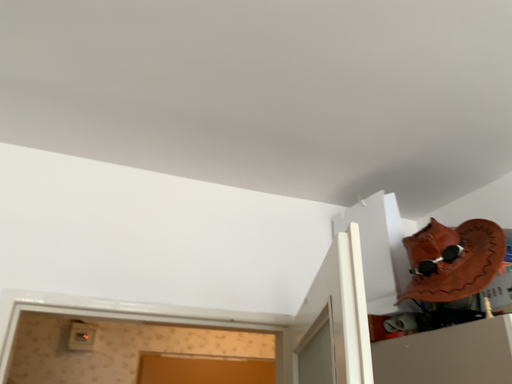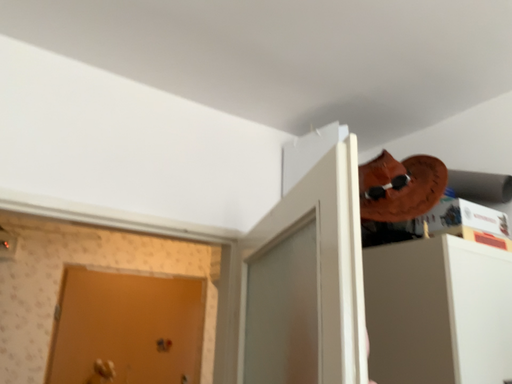
Question: How did the camera likely rotate when shooting the video?

Choices:
 (A) rotated downward
 (B) rotated upward

Answer: (A)